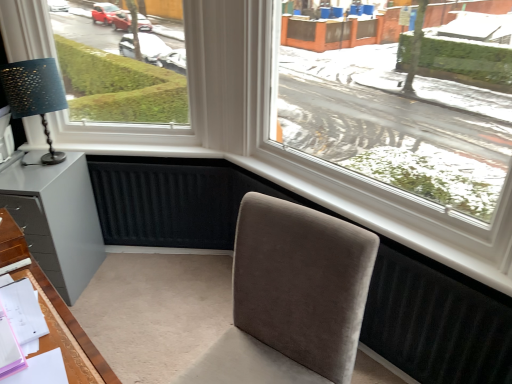
Question: Are transparent glass window at center and matte gray cabinet at lower left located far from each other?

Choices:
 (A) yes
 (B) no

Answer: (A)

Question: From the image's perspective, would you say transparent glass window at center is shown under matte gray cabinet at lower left?

Choices:
 (A) yes
 (B) no

Answer: (B)

Question: Considering the relative sizes of transparent glass window at center and matte gray cabinet at lower left in the image provided, is transparent glass window at center bigger than matte gray cabinet at lower left?

Choices:
 (A) yes
 (B) no

Answer: (A)

Question: Does transparent glass window at center have a greater height compared to matte gray cabinet at lower left?

Choices:
 (A) yes
 (B) no

Answer: (A)

Question: Can you see transparent glass window at center touching matte gray cabinet at lower left?

Choices:
 (A) yes
 (B) no

Answer: (B)

Question: From a real-world perspective, does transparent glass window at center stand above matte gray cabinet at lower left?

Choices:
 (A) no
 (B) yes

Answer: (B)

Question: Is suede-like beige chair at center smaller than matte black lampshade at left?

Choices:
 (A) yes
 (B) no

Answer: (B)

Question: Is suede-like beige chair at center oriented towards matte black lampshade at left?

Choices:
 (A) no
 (B) yes

Answer: (A)

Question: Can you confirm if suede-like beige chair at center is taller than matte black lampshade at left?

Choices:
 (A) no
 (B) yes

Answer: (B)

Question: Considering the relative sizes of suede-like beige chair at center and matte black lampshade at left in the image provided, is suede-like beige chair at center wider than matte black lampshade at left?

Choices:
 (A) no
 (B) yes

Answer: (B)

Question: Are suede-like beige chair at center and matte black lampshade at left far apart?

Choices:
 (A) yes
 (B) no

Answer: (A)

Question: From a real-world perspective, does suede-like beige chair at center stand above matte black lampshade at left?

Choices:
 (A) no
 (B) yes

Answer: (A)

Question: Is matte black lampshade at left wider than suede-like beige chair at center?

Choices:
 (A) yes
 (B) no

Answer: (B)